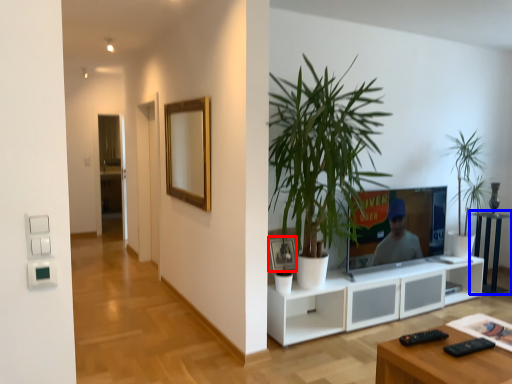
Question: Which object appears farthest to the camera in this image, picture frame (highlighted by a red box) or side table (highlighted by a blue box)?

Choices:
 (A) picture frame
 (B) side table

Answer: (B)